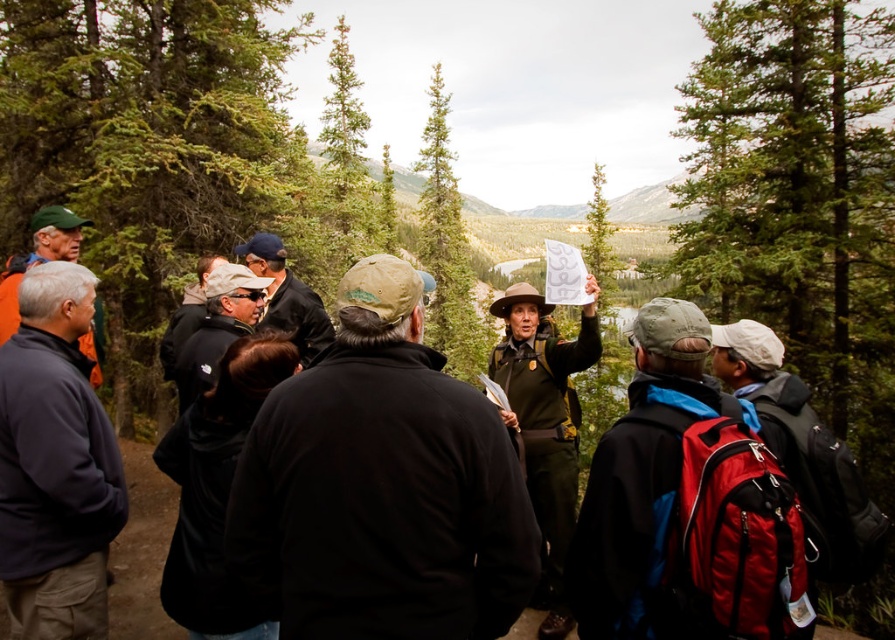
Is point (10, 477) positioned before point (433, 90)?

That is True.

Consider the image. Which is more to the right, dark blue fleece at left or green textured pine tree at center?

green textured pine tree at center is more to the right.

Locate an element on the screen. This screenshot has height=640, width=895. dark blue fleece at left is located at coordinates (55, 465).